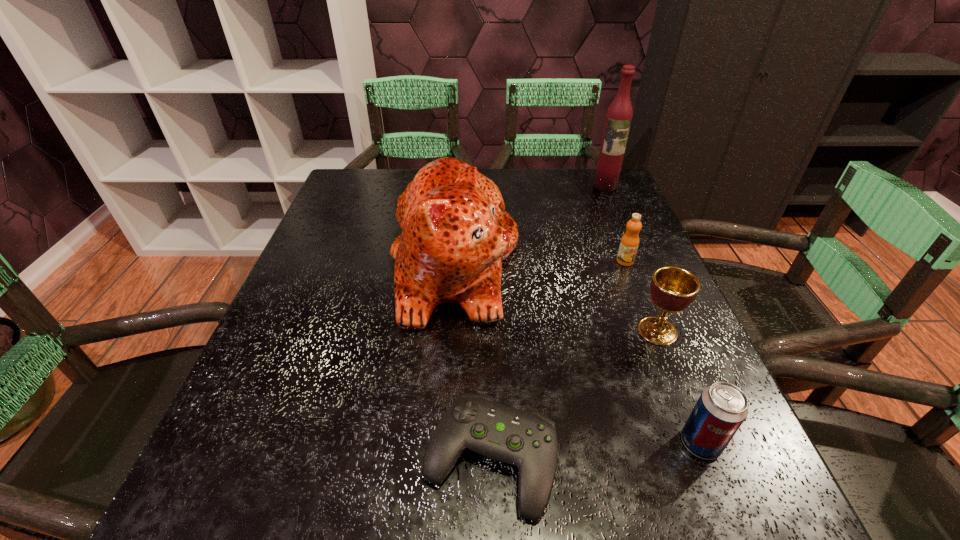
Image resolution: width=960 pixels, height=540 pixels. Find the location of `empty space between the farthest object and the shortest object`. empty space between the farthest object and the shortest object is located at coordinates (548, 322).

Where is `free space between the chalice and the beer can`? Image resolution: width=960 pixels, height=540 pixels. free space between the chalice and the beer can is located at coordinates (679, 387).

I want to click on the third closest object to the orange juice, so click(x=618, y=119).

Identify which object is located as the fifth nearest to the liquor. Please provide its 2D coordinates. Your answer should be formatted as a tuple, i.e. [(x, y)], where the tuple contains the x and y coordinates of a point satisfying the conditions above.

[(721, 409)]

You are a GUI agent. You are given a task and a screenshot of the screen. Output one action in this format:
    pyautogui.click(x=<x>, y=<y>)
    Task: Click on the free point that satisfies the following two spatial constraints: 1. on the face of the cat; 2. on the left side of the shortest object
    This screenshot has height=540, width=960.
    Given the screenshot: What is the action you would take?
    pos(442,459)

Find the location of a particular element. vacant space that satisfies the following two spatial constraints: 1. on the front label of the orange juice; 2. on the face of the cat is located at coordinates (626, 264).

In order to click on free spot that satisfies the following two spatial constraints: 1. on the front label of the orange juice; 2. on the face of the fifth shortest object in this screenshot , I will do pos(626,264).

Identify the location of vacant position in the image that satisfies the following two spatial constraints: 1. on the face of the fifth shortest object; 2. on the right side of the beer can. The height and width of the screenshot is (540, 960). (443, 443).

You are a GUI agent. You are given a task and a screenshot of the screen. Output one action in this format:
    pyautogui.click(x=<x>, y=<y>)
    Task: Click on the vacant space that satisfies the following two spatial constraints: 1. on the face of the beer can; 2. on the right side of the cat
    This screenshot has width=960, height=540.
    Given the screenshot: What is the action you would take?
    pyautogui.click(x=443, y=443)